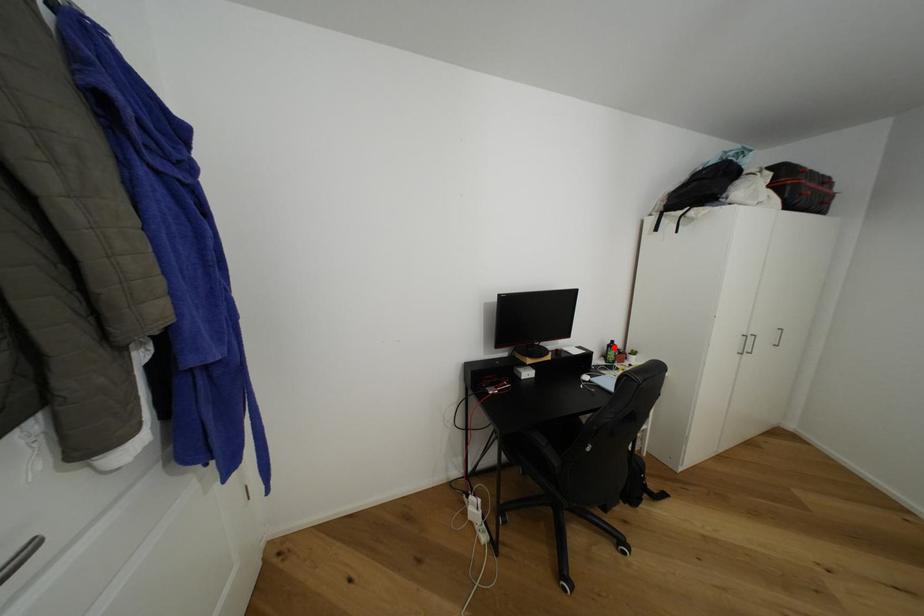
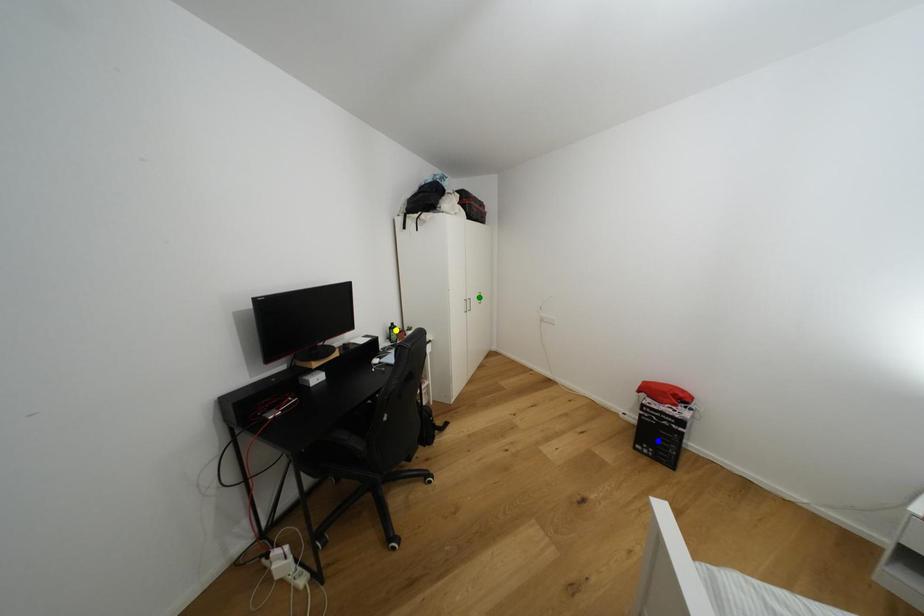
Question: I am providing you with two images of the same scene from different viewpoints. A red point is marked on the first image. You are given multiple points on the second image. Which point in image 2 is actually the same real-world point as the red point in image 1?

Choices:
 (A) blue point
 (B) yellow point
 (C) green point

Answer: (B)